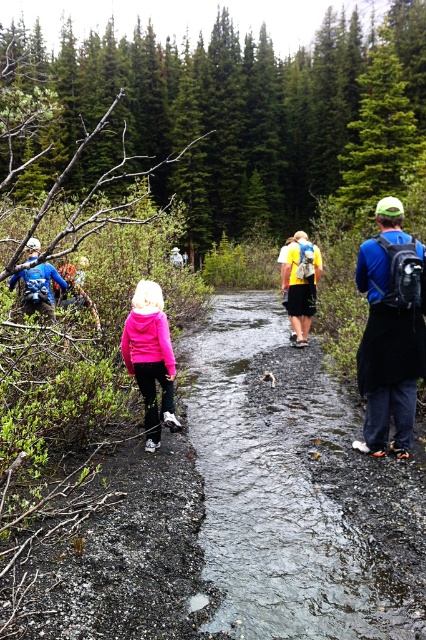
Who is lower down, wet gravel stream at center or pink fleece jacket at center?

Positioned lower is wet gravel stream at center.

Between wet gravel stream at center and pink fleece jacket at center, which one appears on the left side from the viewer's perspective?

From the viewer's perspective, pink fleece jacket at center appears more on the left side.

Image resolution: width=426 pixels, height=640 pixels. In order to click on wet gravel stream at center in this screenshot , I will do `click(296, 490)`.

Does point (385, 300) come farther from viewer compared to point (46, 275)?

No, (385, 300) is in front of (46, 275).

This screenshot has height=640, width=426. Describe the element at coordinates (389, 332) in the screenshot. I see `blue matte backpack at center-right` at that location.

Where is `blue matte backpack at center-right`? This screenshot has height=640, width=426. blue matte backpack at center-right is located at coordinates (389, 332).

Does blue matte backpack at center-right come behind pink fleece jacket at center?

No.

Looking at this image, can you confirm if blue matte backpack at center-right is shorter than pink fleece jacket at center?

In fact, blue matte backpack at center-right may be taller than pink fleece jacket at center.

Who is more distant from viewer, (356, 358) or (138, 285)?

The point (356, 358) is more distant.

At what (x,y) coordinates should I click in order to perform the action: click on blue matte backpack at center-right. Please return your answer as a coordinate pair (x, y). Looking at the image, I should click on (389, 332).